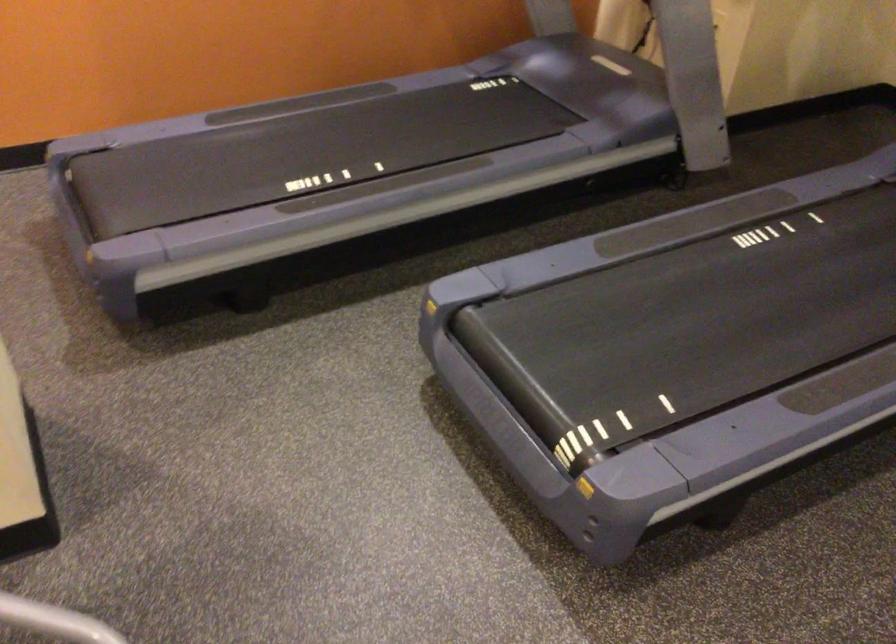
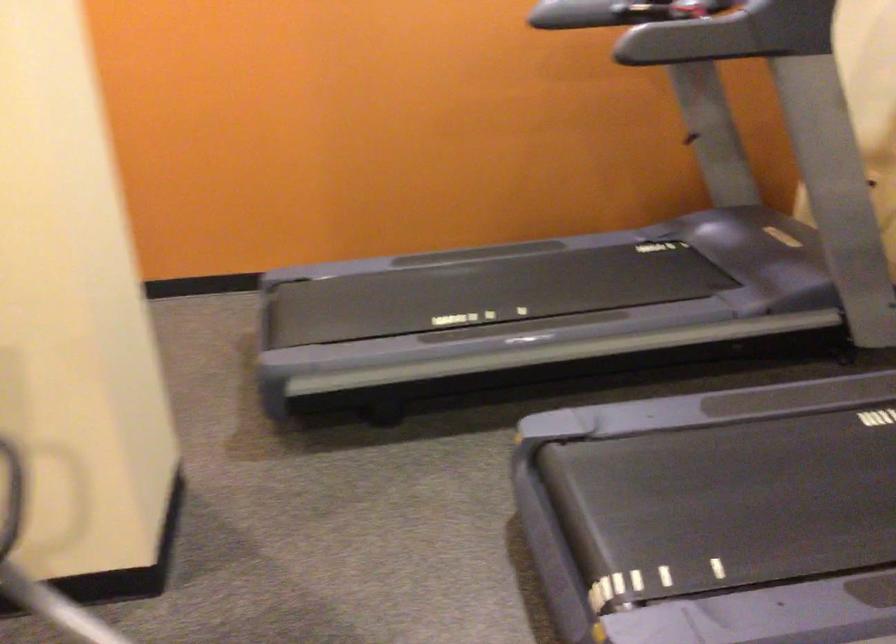
Question: What movement of the cameraman would produce the second image?

Choices:
 (A) Left
 (B) Right
 (C) Forward
 (D) Backward

Answer: (B)